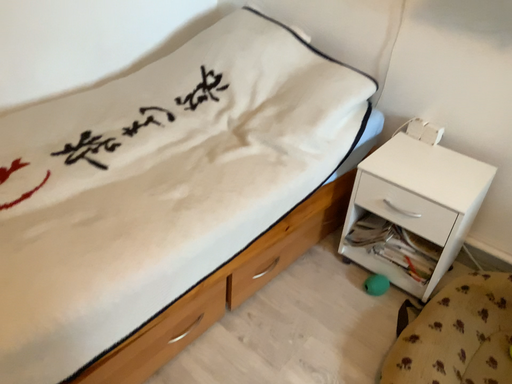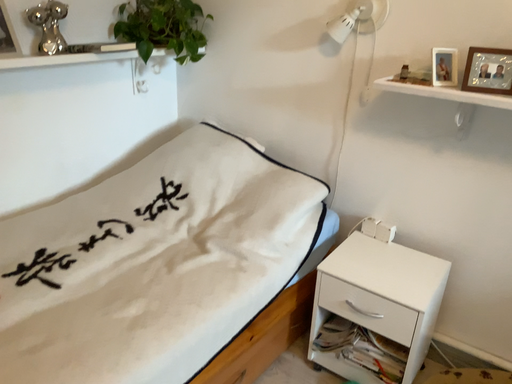
Question: How did the camera likely rotate when shooting the video?

Choices:
 (A) rotated upward
 (B) rotated downward

Answer: (A)